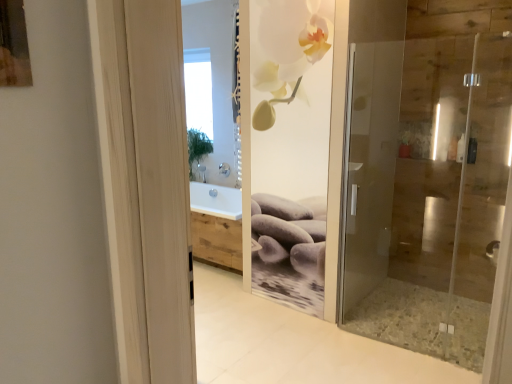
Question: In terms of width, does transparent glass window at upper center look wider or thinner when compared to transparent glass shower door at right?

Choices:
 (A) thin
 (B) wide

Answer: (A)

Question: Is transparent glass window at upper center inside or outside of transparent glass shower door at right?

Choices:
 (A) outside
 (B) inside

Answer: (A)

Question: Is transparent glass window at upper center taller or shorter than transparent glass shower door at right?

Choices:
 (A) tall
 (B) short

Answer: (B)

Question: In the image, is transparent glass shower door at right on the left side or the right side of transparent glass window at upper center?

Choices:
 (A) right
 (B) left

Answer: (A)

Question: From a real-world perspective, is transparent glass shower door at right above or below transparent glass window at upper center?

Choices:
 (A) below
 (B) above

Answer: (A)

Question: From the image's perspective, is transparent glass shower door at right positioned above or below transparent glass window at upper center?

Choices:
 (A) below
 (B) above

Answer: (A)

Question: Considering the positions of transparent glass shower door at right and transparent glass window at upper center in the image, is transparent glass shower door at right taller or shorter than transparent glass window at upper center?

Choices:
 (A) tall
 (B) short

Answer: (A)